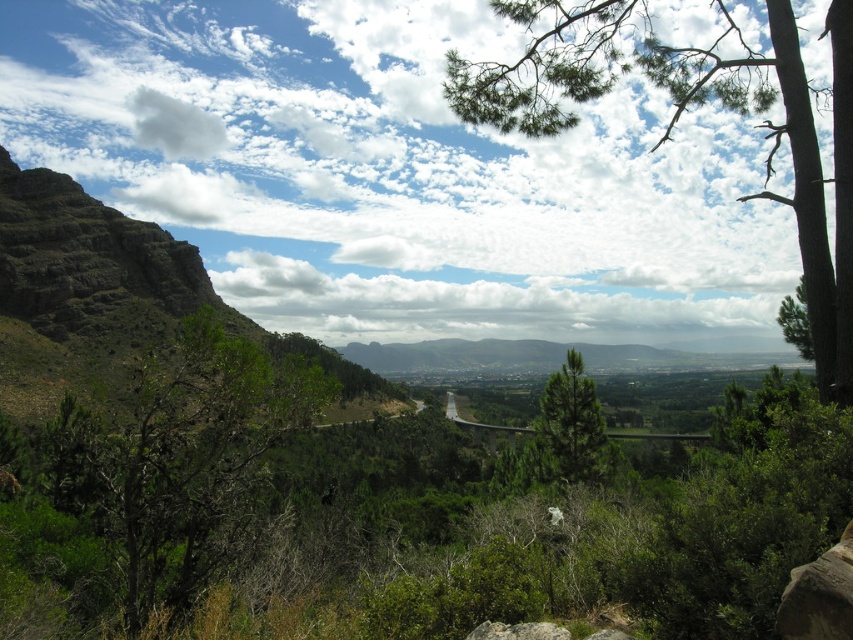
You are standing on the elevated road and looking towards the green textured tree at center. Can you see the gray rough rock at lower center behind it?

The gray rough rock at lower center is behind the green textured tree at center, so yes, you can see it if it is not completely obscured by the tree.

You are a hiker standing at the gray rough rock at lower center. You want to reach the green textured pine tree at right. Which direction should you move to get there?

The green textured pine tree at right is positioned over the gray rough rock at lower center, so you should move upward to reach it.

You are a hiker trying to cross the area between the green textured tree at center and the gray rough rock at lower center. Which object should you avoid stepping on to prevent slipping?

You should avoid stepping on the gray rough rock at lower center because it might be narrower than the green textured tree at center, making it less stable.